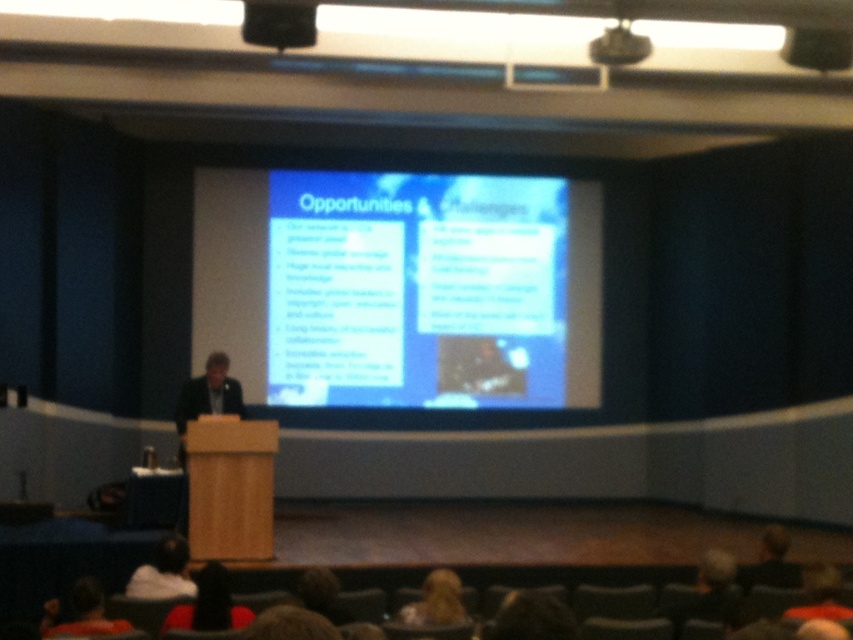
You are an attendee at the presentation and want to take a photo of the slide on the screen. However, your camera has a limited field of view. The black fabric head at lower center and dark brown hair at lower left are blocking your view. Which object is smaller and therefore easier to avoid?

The black fabric head at lower center is smaller compared to the dark brown hair at lower left, so it is easier to avoid.